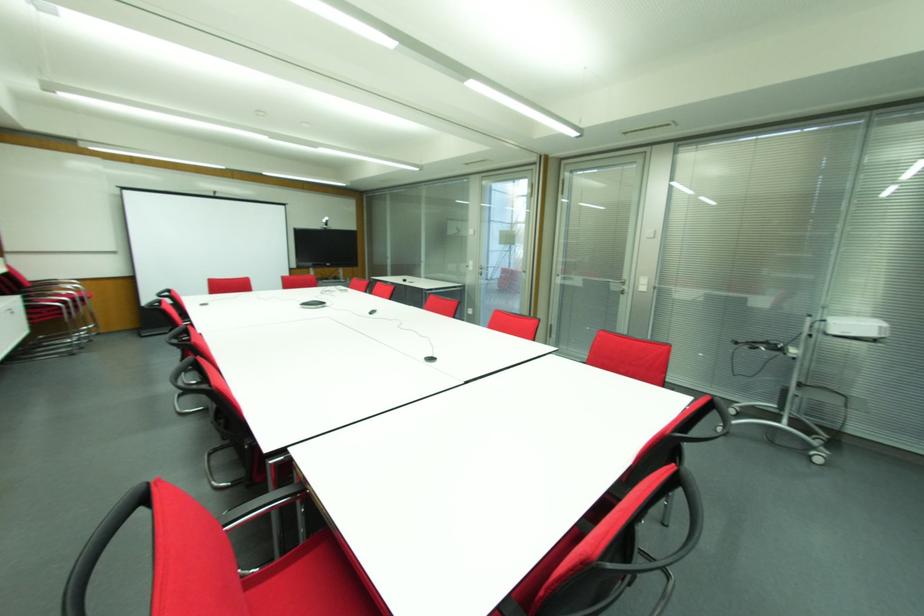
Find the location of `red chair sitting surface`. red chair sitting surface is located at coordinates (329, 597).